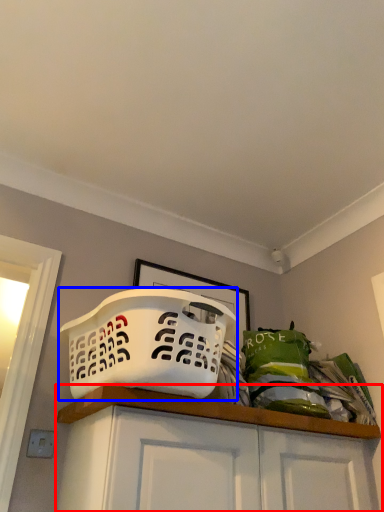
Question: Which point is closer to the camera, cabinetry (highlighted by a red box) or basket (highlighted by a blue box)?

Choices:
 (A) cabinetry
 (B) basket

Answer: (A)